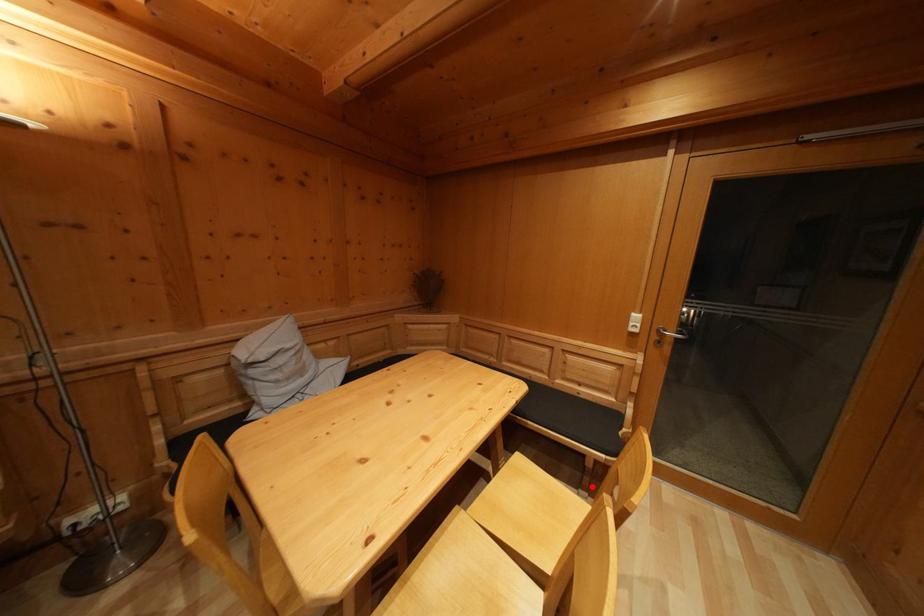
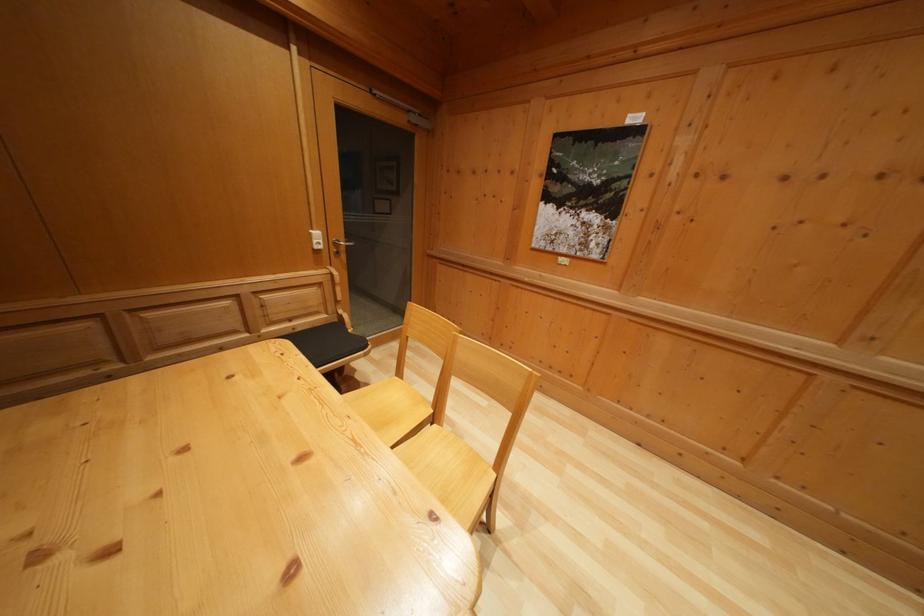
Question: I am providing you with two images of the same scene from different viewpoints. Image1 has a red point marked. In image2, the corresponding 3D location appears at what relative position? Reply with the corresponding letter.

Choices:
 (A) Closer
 (B) Farther

Answer: (A)